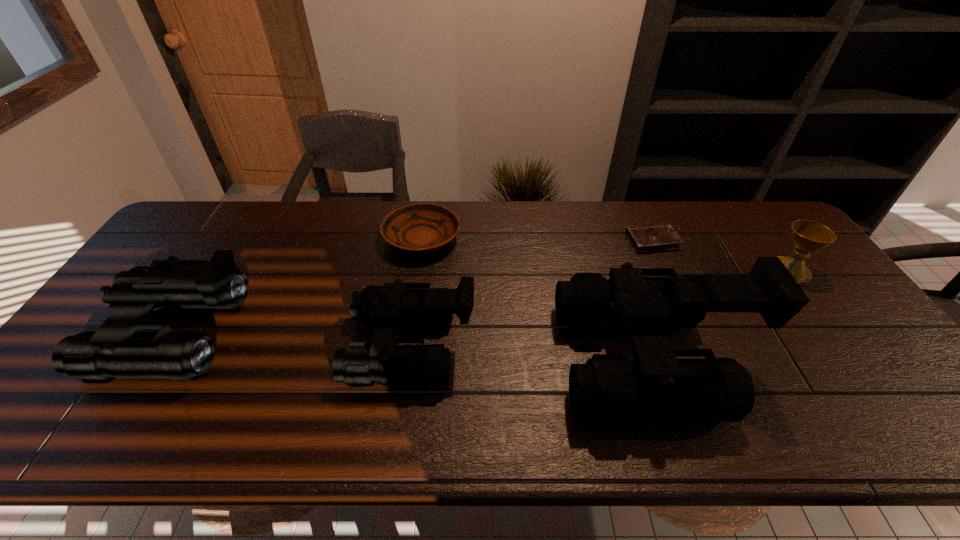
This screenshot has width=960, height=540. Find the location of `the leftmost binoculars`. the leftmost binoculars is located at coordinates (116, 350).

Locate an element on the screen. the second shortest binoculars is located at coordinates (116, 350).

Locate an element on the screen. The width and height of the screenshot is (960, 540). the second binoculars from right to left is located at coordinates pos(384,308).

Where is `the shortest binoculars`? The height and width of the screenshot is (540, 960). the shortest binoculars is located at coordinates (384, 308).

Where is `the rightmost binoculars`? The width and height of the screenshot is (960, 540). the rightmost binoculars is located at coordinates (609, 388).

Locate an element on the screen. Image resolution: width=960 pixels, height=540 pixels. the fifth tallest object is located at coordinates (422, 227).

Locate an element on the screen. The width and height of the screenshot is (960, 540). the rightmost object is located at coordinates 807,237.

Where is `chalice`? chalice is located at coordinates (807, 237).

This screenshot has height=540, width=960. Find the location of `the shortest object`. the shortest object is located at coordinates (647, 238).

Find the location of a particular element. Image resolution: width=960 pixels, height=540 pixels. vacant space situated on the front lenses of the leftmost binoculars is located at coordinates (89, 334).